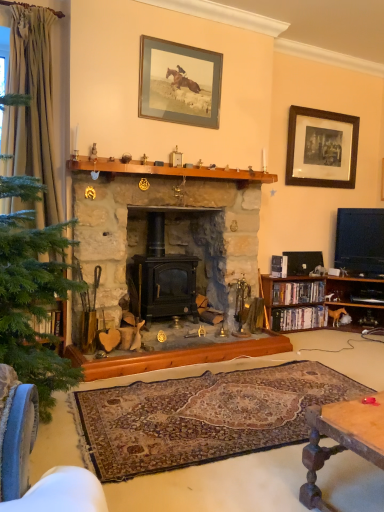
This screenshot has width=384, height=512. Describe the element at coordinates (179, 83) in the screenshot. I see `matte glass picture frame at upper center, the 2th picture frame from the back` at that location.

What do you see at coordinates (169, 223) in the screenshot? The width and height of the screenshot is (384, 512). I see `black stone fireplace at center` at bounding box center [169, 223].

Measure the distance between hardcover books at right, the 1th book in the top-to-bottom sequence, and camera.

The distance of hardcover books at right, the 1th book in the top-to-bottom sequence, from camera is 12.45 feet.

What do you see at coordinates (33, 106) in the screenshot?
I see `creamy silk curtain at left` at bounding box center [33, 106].

Where is `matte glass picture frame at upper center, arranged as the 1th picture frame when viewed from the front`? This screenshot has width=384, height=512. matte glass picture frame at upper center, arranged as the 1th picture frame when viewed from the front is located at coordinates (179, 83).

Can you confirm if wooden bookshelf at right is positioned to the right of black plastic dvds at right, the first book in the bottom-to-top sequence?

Yes.

From the image's perspective, is wooden bookshelf at right under black plastic dvds at right, the second book from the top?

Incorrect, from the image's perspective, wooden bookshelf at right is higher than black plastic dvds at right, the second book from the top.

Who is shorter, wooden bookshelf at right or black plastic dvds at right, the second book from the top?

With less height is black plastic dvds at right, the second book from the top.

Is flat screen tv at right to the left of black stone fireplace at center from the viewer's perspective?

No.

Is flat screen tv at right touching black stone fireplace at center?

No.

Is black stone fireplace at center completely or partially inside flat screen tv at right?

Actually, black stone fireplace at center is outside flat screen tv at right.

Based on the photo, from a real-world perspective, which object stands above the other?

flat screen tv at right.

From the image's perspective, is wooden mantle at center below black plastic phone at lower right?

Incorrect, from the image's perspective, wooden mantle at center is higher than black plastic phone at lower right.

Is wooden mantle at center oriented away from black plastic phone at lower right?

That's not correct — wooden mantle at center is not looking away from black plastic phone at lower right.

Considering the relative positions of wooden mantle at center and black plastic phone at lower right in the image provided, is wooden mantle at center behind black plastic phone at lower right?

No, wooden mantle at center is in front of black plastic phone at lower right.

You are a GUI agent. You are given a task and a screenshot of the screen. Output one action in this format:
    pyautogui.click(x=<x>, y=<y>)
    Task: Click on the 1st book directly beneath the creamy silk curtain at left (from a real-world perspective)
    
    Given the screenshot: What is the action you would take?
    pyautogui.click(x=298, y=292)

Is creamy silk curtain at left in front of or behind hardcover books at right, which appears as the 2th book when ordered from the bottom, in the image?

In the image, creamy silk curtain at left appears in front of hardcover books at right, which appears as the 2th book when ordered from the bottom.

Who is shorter, creamy silk curtain at left or hardcover books at right, which appears as the 2th book when ordered from the bottom?

With less height is hardcover books at right, which appears as the 2th book when ordered from the bottom.

Is flat screen tv at right not close to wooden mantle at center?

Absolutely, flat screen tv at right is distant from wooden mantle at center.

Which of these two, flat screen tv at right or wooden mantle at center, stands shorter?

wooden mantle at center is shorter.

From a real-world perspective, who is located lower, flat screen tv at right or wooden mantle at center?

flat screen tv at right, from a real-world perspective.

Between matte glass picture frame at upper center, arranged as the 1th picture frame when viewed from the front, and black plastic phone at lower right, which one is positioned in front?

Positioned in front is matte glass picture frame at upper center, arranged as the 1th picture frame when viewed from the front.

Which of these two, matte glass picture frame at upper center, the 2th picture frame from the back, or black plastic phone at lower right, is wider?

Wider between the two is black plastic phone at lower right.

Is matte glass picture frame at upper center, the 2th picture frame from the back, completely or partially outside of creamy silk curtain at left?

matte glass picture frame at upper center, the 2th picture frame from the back, lies outside creamy silk curtain at left's area.

From the creamy silk curtain at left, count 1st picture frames backward and point to it. Please provide its 2D coordinates.

[(179, 83)]

Can you see matte glass picture frame at upper center, the 2th picture frame from the back, touching creamy silk curtain at left?

No, matte glass picture frame at upper center, the 2th picture frame from the back, is not making contact with creamy silk curtain at left.

Does matte glass picture frame at upper center, arranged as the 1th picture frame when viewed from the front, come in front of creamy silk curtain at left?

No, matte glass picture frame at upper center, arranged as the 1th picture frame when viewed from the front, is further to the viewer.

Find the location of a particular element. Image resolution: width=384 pixels, height=512 pixels. cabinetry that is on the right side of black plastic dvds at right, the first book in the bottom-to-top sequence is located at coordinates (318, 300).

Where is `fireplace below the flat screen tv at right (from a real-world perspective)`? The height and width of the screenshot is (512, 384). fireplace below the flat screen tv at right (from a real-world perspective) is located at coordinates (169, 223).

Which object lies nearer to the anchor point black plastic phone at lower right, wooden mantle at center or matte glass picture frame at upper center, the 2th picture frame from the back?

Based on the image, wooden mantle at center appears to be nearer to black plastic phone at lower right.

Looking at the image, which one is located further to flat screen tv at right, creamy silk curtain at left or black plastic phone at lower right?

Based on the image, creamy silk curtain at left appears to be further to flat screen tv at right.

Looking at the image, which one is located further to black stone fireplace at center, wooden bookshelf at right or black plastic dvds at right, the first book in the bottom-to-top sequence?

Based on the image, black plastic dvds at right, the first book in the bottom-to-top sequence, appears to be further to black stone fireplace at center.

Consider the image. From the image, which object appears to be nearer to black stone fireplace at center, black plastic dvds at right, the second book from the top, or matte glass picture frame at upper center, arranged as the 1th picture frame when viewed from the front?

matte glass picture frame at upper center, arranged as the 1th picture frame when viewed from the front, is closer to black stone fireplace at center.

Considering their positions, is wooden bookshelf at right positioned closer to black plastic phone at lower right than matte glass picture frame at upper center, the 2th picture frame from the back?

wooden bookshelf at right lies closer to black plastic phone at lower right than the other object.

Considering their positions, is black wood picture frame at upper right, which is counted as the second picture frame, starting from the front, positioned closer to black stone fireplace at center than flat screen tv at right?

Among the two, black wood picture frame at upper right, which is counted as the second picture frame, starting from the front, is located nearer to black stone fireplace at center.

From the image, which object appears to be nearer to matte glass picture frame at upper center, the 2th picture frame in the right-to-left sequence, creamy silk curtain at left or wooden mantle at center?

wooden mantle at center.

Looking at the image, which one is located further to wooden mantle at center, flat screen tv at right or black plastic phone at lower right?

flat screen tv at right is further to wooden mantle at center.

This screenshot has height=512, width=384. I want to click on cabinetry situated between creamy silk curtain at left and flat screen tv at right from left to right, so click(x=318, y=300).

Identify the location of mantle situated between creamy silk curtain at left and black wood picture frame at upper right, which ranks as the 1th picture frame in back-to-front order, from left to right. (167, 170).

This screenshot has height=512, width=384. In order to click on cabinetry situated between wooden mantle at center and flat screen tv at right from left to right in this screenshot , I will do `click(318, 300)`.

The height and width of the screenshot is (512, 384). I want to click on corded phone between matte glass picture frame at upper center, arranged as the 1th picture frame when viewed from the front, and wooden bookshelf at right from top to bottom, so click(x=303, y=262).